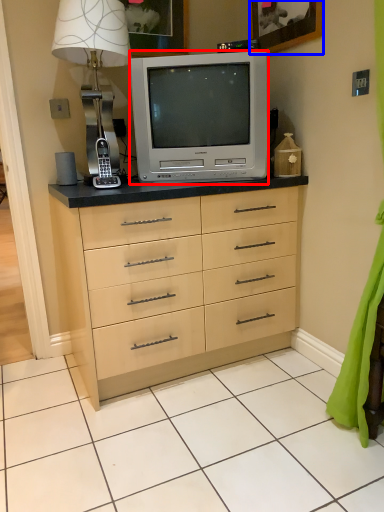
Question: Which object appears closest to the camera in this image, television (highlighted by a red box) or picture frame (highlighted by a blue box)?

Choices:
 (A) television
 (B) picture frame

Answer: (B)